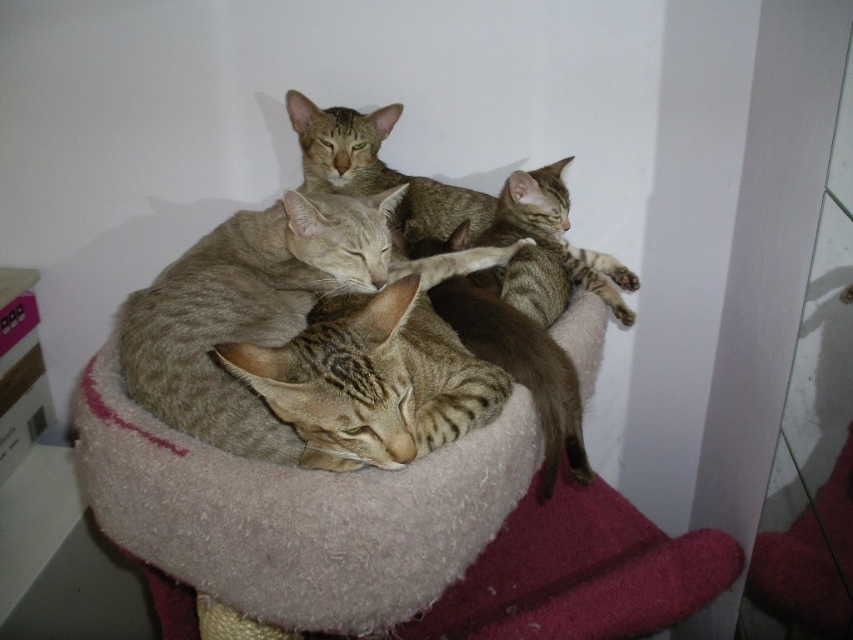
What do you see at coordinates (297, 513) in the screenshot?
I see `beige woolen cat bed at center` at bounding box center [297, 513].

Between beige woolen cat bed at center and tabby fur cat at center, which one appears on the right side from the viewer's perspective?

Positioned to the right is tabby fur cat at center.

Is point (149, 504) positioned in front of point (578, 252)?

Yes, it is.

Locate an element on the screen. beige woolen cat bed at center is located at coordinates click(297, 513).